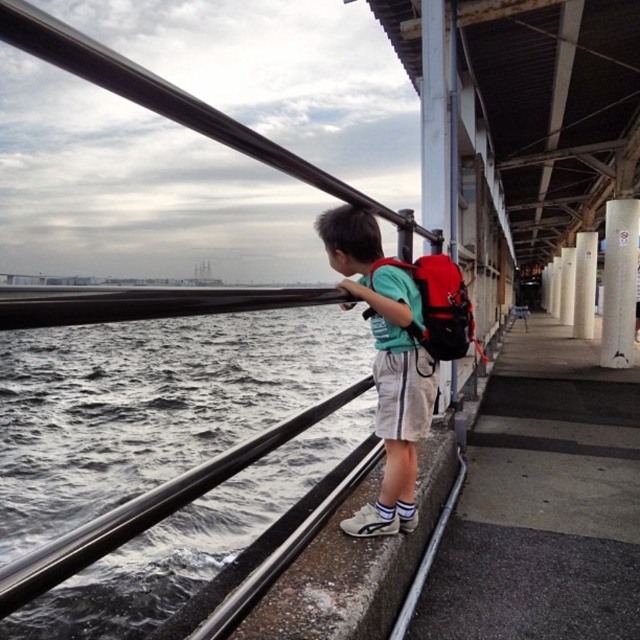
Question: Can you confirm if gray matte water at left is thinner than green fabric backpack at center?

Choices:
 (A) yes
 (B) no

Answer: (B)

Question: Can you confirm if gray matte water at left is positioned above green fabric backpack at center?

Choices:
 (A) no
 (B) yes

Answer: (A)

Question: Which point is closer to the camera?

Choices:
 (A) green fabric backpack at center
 (B) gray matte water at left

Answer: (B)

Question: Which of the following is the closest to the observer?

Choices:
 (A) (77, 419)
 (B) (380, 371)

Answer: (B)

Question: Is gray matte water at left smaller than green fabric backpack at center?

Choices:
 (A) yes
 (B) no

Answer: (B)

Question: Which of the following is the closest to the observer?

Choices:
 (A) green fabric backpack at center
 (B) gray matte water at left

Answer: (B)